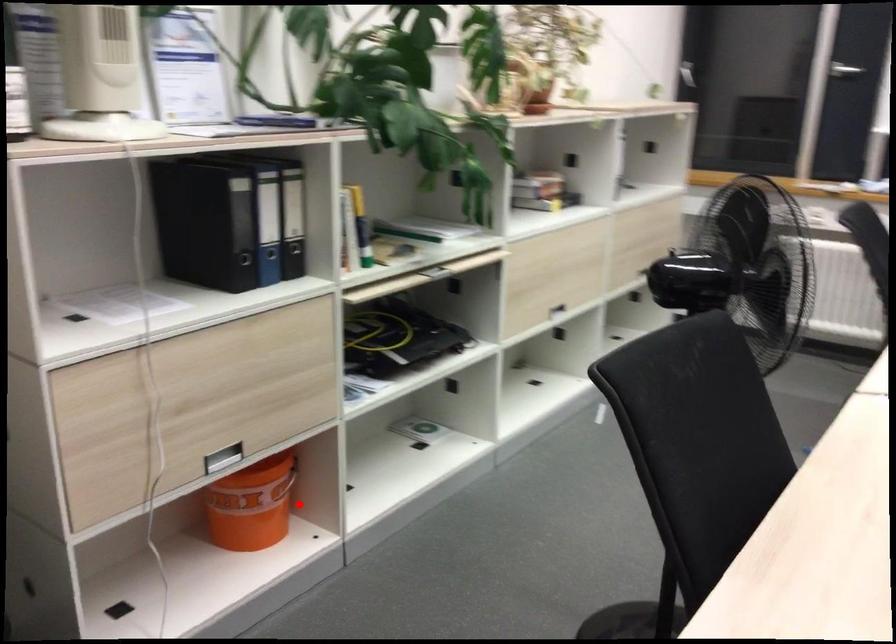
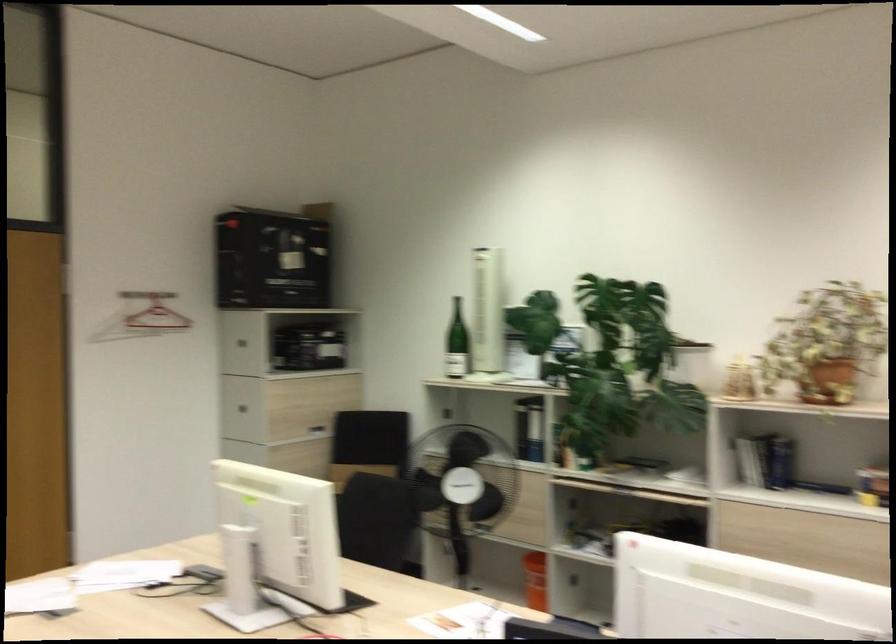
Find the pixel in the second image that matches the highlighted location in the first image.

(535, 580)